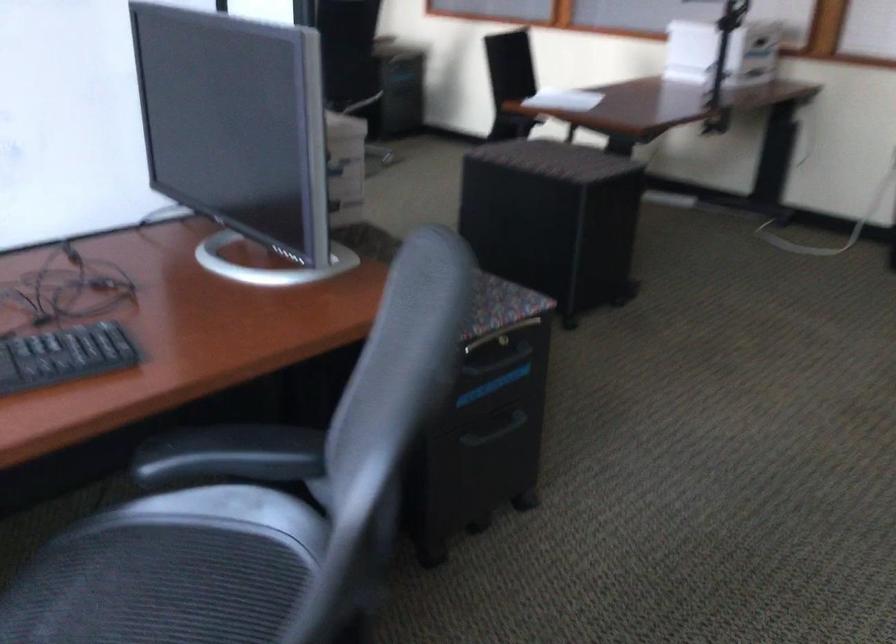
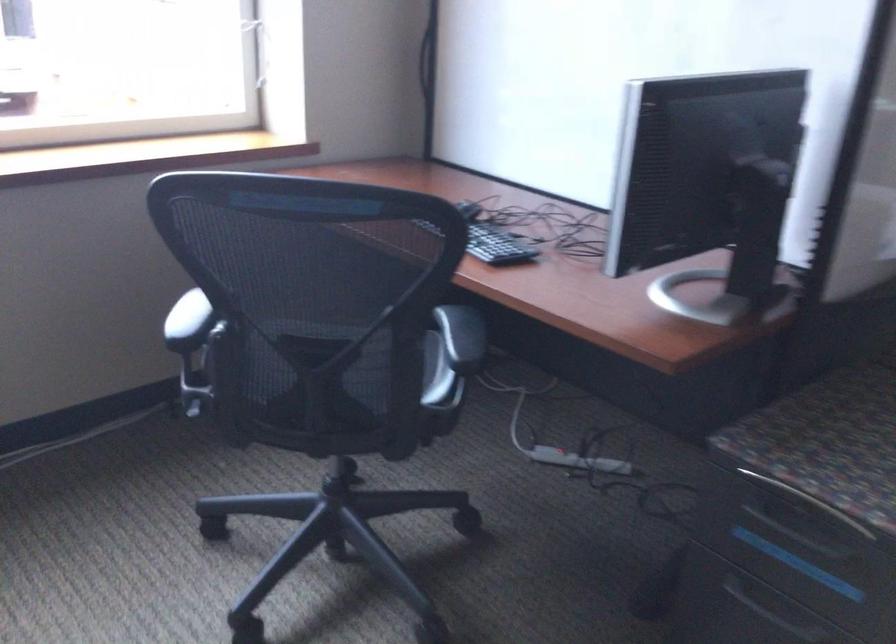
Where in the second image is the point corresponding to point (226, 536) from the first image?

(435, 373)